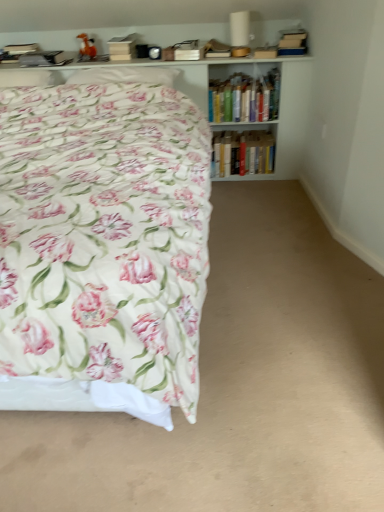
This screenshot has width=384, height=512. Find the location of `hardcover books at upper right, which appears as the first book when viewed from the top`. hardcover books at upper right, which appears as the first book when viewed from the top is located at coordinates (244, 98).

How much space does hardcover books at upper right, which appears as the first book when viewed from the top, occupy vertically?

The height of hardcover books at upper right, which appears as the first book when viewed from the top, is 11.44 inches.

Measure the distance between point (19,78) and camera.

The distance of point (19,78) from camera is 8.05 feet.

Describe the element at coordinates (125, 75) in the screenshot. I see `white soft pillow at upper left, the 1th pillow from the right` at that location.

In order to face floral fabric bed at left, should I rotate leftwards or rightwards?

You should rotate left by 19.239 degrees.

Describe the element at coordinates (102, 248) in the screenshot. I see `floral fabric bed at left` at that location.

The height and width of the screenshot is (512, 384). I want to click on white glossy bookcase at upper center, so click(280, 99).

Can you tell me how much white soft pillow at upper left, the second pillow in the right-to-left sequence, and hardcover books at center, which is the 2th book in top-to-bottom order, differ in facing direction?

They differ by 0.189 degrees in their facing directions.

Can you confirm if white soft pillow at upper left, the second pillow in the right-to-left sequence, is bigger than hardcover books at center, which is the 2th book in top-to-bottom order?

No.

Considering the relative sizes of white soft pillow at upper left, the second pillow in the right-to-left sequence, and hardcover books at center, which is the 2th book in top-to-bottom order, in the image provided, is white soft pillow at upper left, the second pillow in the right-to-left sequence, shorter than hardcover books at center, which is the 2th book in top-to-bottom order,?

Indeed, white soft pillow at upper left, the second pillow in the right-to-left sequence, has a lesser height compared to hardcover books at center, which is the 2th book in top-to-bottom order.

Is white soft pillow at upper left, the 2th pillow when ordered from left to right, turned away from white soft pillow at upper left, which ranks as the 1th pillow in left-to-right order?

white soft pillow at upper left, the 2th pillow when ordered from left to right, is not turned away from white soft pillow at upper left, which ranks as the 1th pillow in left-to-right order.

Where is `pillow located below the white soft pillow at upper left, the 2th pillow when ordered from left to right (from the image's perspective)`? pillow located below the white soft pillow at upper left, the 2th pillow when ordered from left to right (from the image's perspective) is located at coordinates (26, 78).

Which is in front, white soft pillow at upper left, the 2th pillow when ordered from left to right, or white soft pillow at upper left, the second pillow in the right-to-left sequence?

white soft pillow at upper left, the second pillow in the right-to-left sequence, is closer to the camera.

Is white soft pillow at upper left, which ranks as the 1th pillow in left-to-right order, far away from white glossy bookcase at upper center?

Yes, white soft pillow at upper left, which ranks as the 1th pillow in left-to-right order, is far from white glossy bookcase at upper center.

Considering the relative sizes of white soft pillow at upper left, which ranks as the 1th pillow in left-to-right order, and white glossy bookcase at upper center in the image provided, is white soft pillow at upper left, which ranks as the 1th pillow in left-to-right order, thinner than white glossy bookcase at upper center?

Yes.

Based on their positions, is white soft pillow at upper left, the second pillow in the right-to-left sequence, located to the left or right of white glossy bookcase at upper center?

From the image, it's evident that white soft pillow at upper left, the second pillow in the right-to-left sequence, is to the left of white glossy bookcase at upper center.

Can you confirm if white soft pillow at upper left, the second pillow in the right-to-left sequence, is shorter than white glossy bookcase at upper center?

Correct, white soft pillow at upper left, the second pillow in the right-to-left sequence, is not as tall as white glossy bookcase at upper center.

Considering the relative positions of hardcover books at upper right, which appears as the first book when viewed from the top, and hardcover books at center, marked as the first book in a bottom-to-top arrangement, in the image provided, is hardcover books at upper right, which appears as the first book when viewed from the top, behind hardcover books at center, marked as the first book in a bottom-to-top arrangement,?

No, it is in front of hardcover books at center, marked as the first book in a bottom-to-top arrangement.

From the image's perspective, is hardcover books at upper right, placed as the second book when sorted from bottom to top, located above or below hardcover books at center, marked as the first book in a bottom-to-top arrangement?

From the image's perspective, hardcover books at upper right, placed as the second book when sorted from bottom to top, appears above hardcover books at center, marked as the first book in a bottom-to-top arrangement.

Where is `book on the left side of hardcover books at center, which is the 2th book in top-to-bottom order`? This screenshot has height=512, width=384. book on the left side of hardcover books at center, which is the 2th book in top-to-bottom order is located at coordinates (244, 98).

From the picture: Considering the relative sizes of hardcover books at upper right, which appears as the first book when viewed from the top, and hardcover books at center, which is the 2th book in top-to-bottom order, in the image provided, is hardcover books at upper right, which appears as the first book when viewed from the top, shorter than hardcover books at center, which is the 2th book in top-to-bottom order,?

No, hardcover books at upper right, which appears as the first book when viewed from the top, is not shorter than hardcover books at center, which is the 2th book in top-to-bottom order.

From the image's perspective, is white glossy bookcase at upper center located above hardcover books at upper right, placed as the second book when sorted from bottom to top?

No, from the image's perspective, white glossy bookcase at upper center is not above hardcover books at upper right, placed as the second book when sorted from bottom to top.

Can you confirm if white glossy bookcase at upper center is taller than hardcover books at upper right, which appears as the first book when viewed from the top?

Correct, white glossy bookcase at upper center is much taller as hardcover books at upper right, which appears as the first book when viewed from the top.

Is white glossy bookcase at upper center positioned with its back to hardcover books at upper right, which appears as the first book when viewed from the top?

That's right, white glossy bookcase at upper center is facing away from hardcover books at upper right, which appears as the first book when viewed from the top.

Find the location of a particular element. the 1st pillow counting from the left side of the white glossy bookcase at upper center is located at coordinates 125,75.

Is white glossy bookcase at upper center smaller than white soft pillow at upper left, the 2th pillow when ordered from left to right?

Actually, white glossy bookcase at upper center might be larger than white soft pillow at upper left, the 2th pillow when ordered from left to right.

From a real-world perspective, is white glossy bookcase at upper center physically located above or below white soft pillow at upper left, the 2th pillow when ordered from left to right?

white glossy bookcase at upper center is below white soft pillow at upper left, the 2th pillow when ordered from left to right.

Is white glossy bookcase at upper center far away from white soft pillow at upper left, the 1th pillow from the right?

That's not correct — white glossy bookcase at upper center is a little close to white soft pillow at upper left, the 1th pillow from the right.

Considering the positions of point (182, 368) and point (252, 73), is point (182, 368) closer or farther from the camera than point (252, 73)?

Point (182, 368) is closer to the camera than point (252, 73).

Is floral fabric bed at left oriented towards white glossy bookcase at upper center?

No, floral fabric bed at left is not facing towards white glossy bookcase at upper center.

Considering the relative positions of floral fabric bed at left and white glossy bookcase at upper center in the image provided, is floral fabric bed at left in front of white glossy bookcase at upper center?

Yes, it is.

Considering the relative positions of floral fabric bed at left and white glossy bookcase at upper center in the image provided, is floral fabric bed at left to the left or to the right of white glossy bookcase at upper center?

Based on their positions, floral fabric bed at left is located to the left of white glossy bookcase at upper center.

Where is `book that is the 2nd object to the right of the white soft pillow at upper left, which ranks as the 1th pillow in left-to-right order, starting at the anchor`? book that is the 2nd object to the right of the white soft pillow at upper left, which ranks as the 1th pillow in left-to-right order, starting at the anchor is located at coordinates (243, 153).

Identify the location of pillow in front of the white soft pillow at upper left, the 1th pillow from the right. (26, 78).

Based on their spatial positions, is white glossy bookcase at upper center or white soft pillow at upper left, the 2th pillow when ordered from left to right, further from hardcover books at center, marked as the first book in a bottom-to-top arrangement?

Among the two, white soft pillow at upper left, the 2th pillow when ordered from left to right, is located further to hardcover books at center, marked as the first book in a bottom-to-top arrangement.

Looking at the image, which one is located closer to white glossy bookcase at upper center, hardcover books at upper right, which appears as the first book when viewed from the top, or white soft pillow at upper left, the 2th pillow when ordered from left to right?

hardcover books at upper right, which appears as the first book when viewed from the top, is positioned closer to the anchor white glossy bookcase at upper center.

Based on their spatial positions, is hardcover books at upper right, placed as the second book when sorted from bottom to top, or hardcover books at center, marked as the first book in a bottom-to-top arrangement, further from white glossy bookcase at upper center?

hardcover books at center, marked as the first book in a bottom-to-top arrangement, lies further to white glossy bookcase at upper center than the other object.

Looking at this image, estimate the real-world distances between objects in this image. Which object is further from hardcover books at upper right, which appears as the first book when viewed from the top, white soft pillow at upper left, the 1th pillow from the right, or hardcover books at center, which is the 2th book in top-to-bottom order?

white soft pillow at upper left, the 1th pillow from the right, is positioned further to the anchor hardcover books at upper right, which appears as the first book when viewed from the top.

Which object lies further to the anchor point hardcover books at upper right, which appears as the first book when viewed from the top, floral fabric bed at left or white glossy bookcase at upper center?

Based on the image, floral fabric bed at left appears to be further to hardcover books at upper right, which appears as the first book when viewed from the top.

Looking at the image, which one is located closer to hardcover books at upper right, placed as the second book when sorted from bottom to top, white glossy bookcase at upper center or white soft pillow at upper left, the 2th pillow when ordered from left to right?

The object closer to hardcover books at upper right, placed as the second book when sorted from bottom to top, is white glossy bookcase at upper center.

Considering their positions, is white glossy bookcase at upper center positioned closer to hardcover books at upper right, which appears as the first book when viewed from the top, than floral fabric bed at left?

white glossy bookcase at upper center is closer to hardcover books at upper right, which appears as the first book when viewed from the top.

Estimate the real-world distances between objects in this image. Which object is further from white soft pillow at upper left, the 2th pillow when ordered from left to right, hardcover books at upper right, which appears as the first book when viewed from the top, or hardcover books at center, marked as the first book in a bottom-to-top arrangement?

Among the two, hardcover books at center, marked as the first book in a bottom-to-top arrangement, is located further to white soft pillow at upper left, the 2th pillow when ordered from left to right.

This screenshot has height=512, width=384. Identify the location of bookcase between white soft pillow at upper left, the 1th pillow from the right, and hardcover books at center, which is the 2th book in top-to-bottom order. (280, 99).

The width and height of the screenshot is (384, 512). Find the location of `book located between floral fabric bed at left and hardcover books at center, marked as the first book in a bottom-to-top arrangement, in the depth direction`. book located between floral fabric bed at left and hardcover books at center, marked as the first book in a bottom-to-top arrangement, in the depth direction is located at coordinates (244, 98).

Locate an element on the screen. The width and height of the screenshot is (384, 512). bookcase between floral fabric bed at left and hardcover books at upper right, placed as the second book when sorted from bottom to top, along the z-axis is located at coordinates (280, 99).

The image size is (384, 512). Identify the location of bookcase between white soft pillow at upper left, the second pillow in the right-to-left sequence, and hardcover books at center, marked as the first book in a bottom-to-top arrangement. (280, 99).